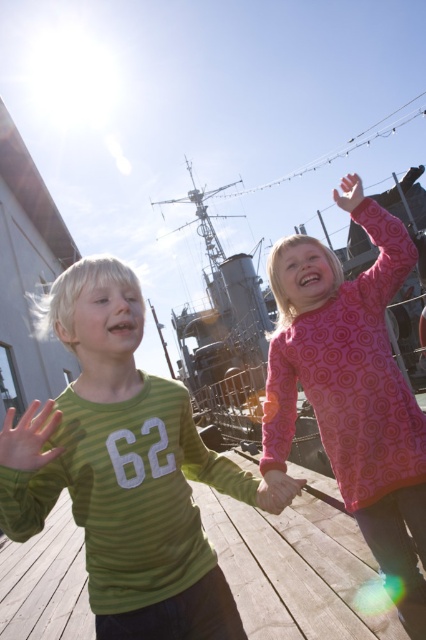
You are a photographer trying to capture a photo of the wooden at center and the pink matte hand at upper right. Which object should you focus on first if you want to ensure both are in sharp focus, considering their sizes?

The wooden at center has a smaller size compared to the pink matte hand at upper right. To ensure both are in sharp focus, you should focus on the wooden at center first since smaller objects often require precise focusing to capture details clearly.

You are standing on the wooden deck where the two children are running. You see two points marked on the deck. The first point is at coordinate point (242, 406) and the second is at point (0, 460). If you want to walk from the first point to the second point, which direction should you move relative to the second point?

You should move forward relative to the second point because point (242, 406) is behind point (0, 460).